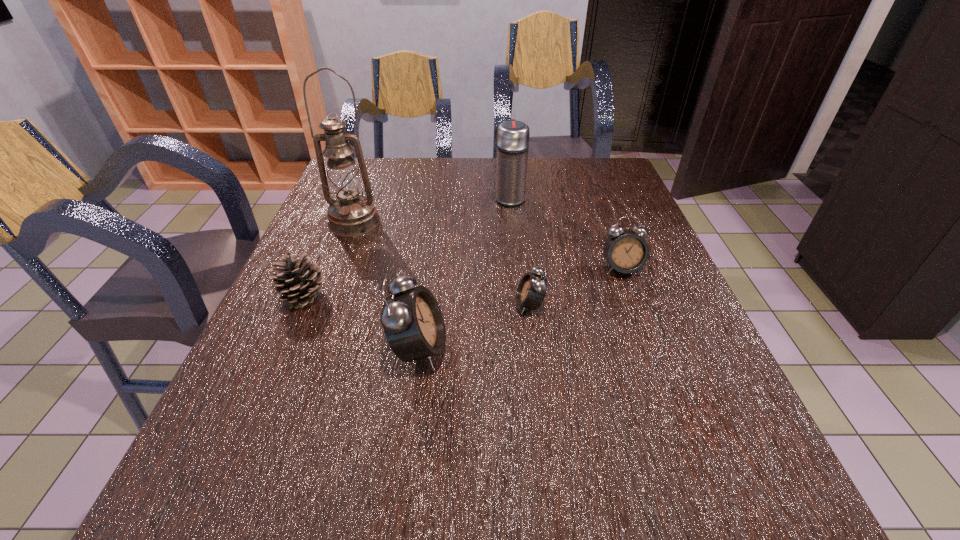
This screenshot has width=960, height=540. I want to click on unoccupied position between the farthest object and the fifth nearest object, so click(432, 210).

What are the coordinates of `free space between the fourth nearest object and the pinecone` in the screenshot? It's located at (463, 282).

Locate an element on the screen. free space between the pinecone and the third tallest object is located at coordinates (362, 322).

Identify the location of vacant space in between the oil lamp and the fourth nearest object. (488, 245).

The height and width of the screenshot is (540, 960). Find the location of `free area in between the second shortest alarm clock and the tallest alarm clock`. free area in between the second shortest alarm clock and the tallest alarm clock is located at coordinates pyautogui.click(x=520, y=309).

The width and height of the screenshot is (960, 540). Find the location of `empty space that is in between the shortest alarm clock and the fourth object from right to left`. empty space that is in between the shortest alarm clock and the fourth object from right to left is located at coordinates (474, 327).

Where is `vacant space in between the nearest alarm clock and the fifth shortest object`? This screenshot has width=960, height=540. vacant space in between the nearest alarm clock and the fifth shortest object is located at coordinates (465, 273).

The width and height of the screenshot is (960, 540). I want to click on blank region between the nearest object and the pinecone, so coord(362,322).

Where is `free area in between the second farthest object and the farthest object`? free area in between the second farthest object and the farthest object is located at coordinates tap(432, 210).

Where is `empty space between the pinecone and the second tallest object`? This screenshot has height=540, width=960. empty space between the pinecone and the second tallest object is located at coordinates (407, 247).